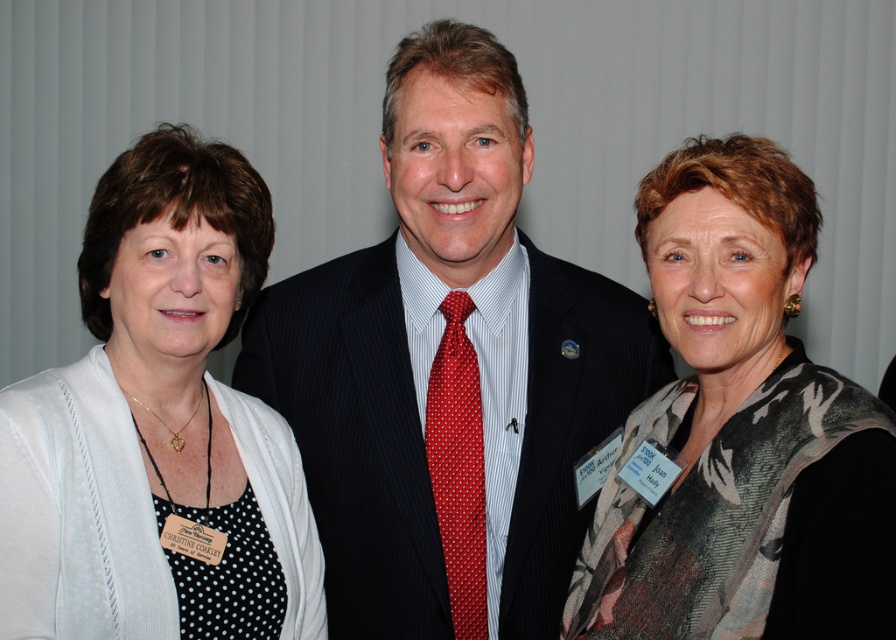
You are organizing a costume party and need to decide which accessory to use as a prop. You have the floral scarf at center and the red dotted tie at center. Which one is bigger in size?

The floral scarf at center is larger in size compared to the red dotted tie at center, so you should choose the floral scarf at center as the prop.

You are at a formal event and need to find the person wearing the dark blue suit at center. Which direction should you look relative to the red dotted tie at center?

The dark blue suit at center is to the right of the red dotted tie at center, so you should look to the right of the red dotted tie at center to find the person wearing the dark blue suit at center.